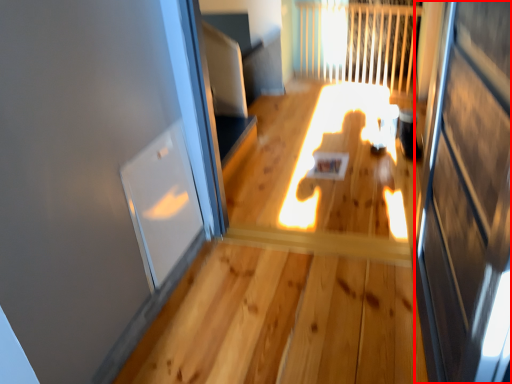
Question: From the image's perspective, what is the correct spatial relationship of screen door (annotated by the red box) in relation to window?

Choices:
 (A) above
 (B) below

Answer: (B)